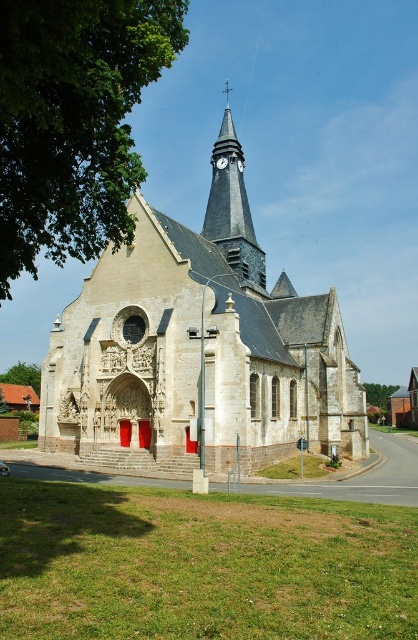
Question: Which of the following is the closest to the observer?

Choices:
 (A) green leafy tree at upper left
 (B) light beige stone church at center
 (C) metallic clock tower at upper center
 (D) green leafy tree at lower left

Answer: (A)

Question: Can you confirm if green leafy tree at upper left is thinner than metallic clock tower at upper center?

Choices:
 (A) yes
 (B) no

Answer: (B)

Question: Which point is farther from the camera taking this photo?

Choices:
 (A) (132, 72)
 (B) (224, 129)
 (C) (221, 156)

Answer: (B)

Question: Does green leafy tree at upper left have a lesser width compared to dark gray stone clock tower at upper center?

Choices:
 (A) yes
 (B) no

Answer: (B)

Question: Which point is farther from the camera taking this photo?

Choices:
 (A) (209, 224)
 (B) (257, 324)

Answer: (A)

Question: Can you confirm if light beige stone church at center is thinner than green leafy tree at upper left?

Choices:
 (A) yes
 (B) no

Answer: (B)